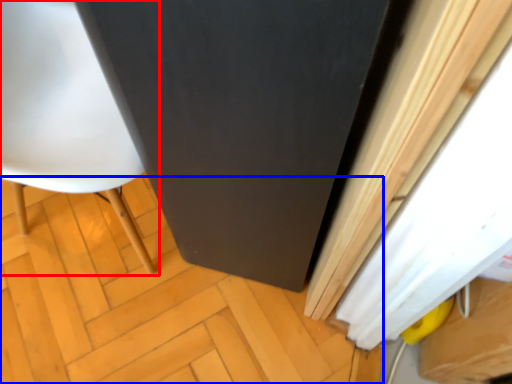
Question: Which point is further to the camera, chair (highlighted by a red box) or plywood (highlighted by a blue box)?

Choices:
 (A) chair
 (B) plywood

Answer: (B)